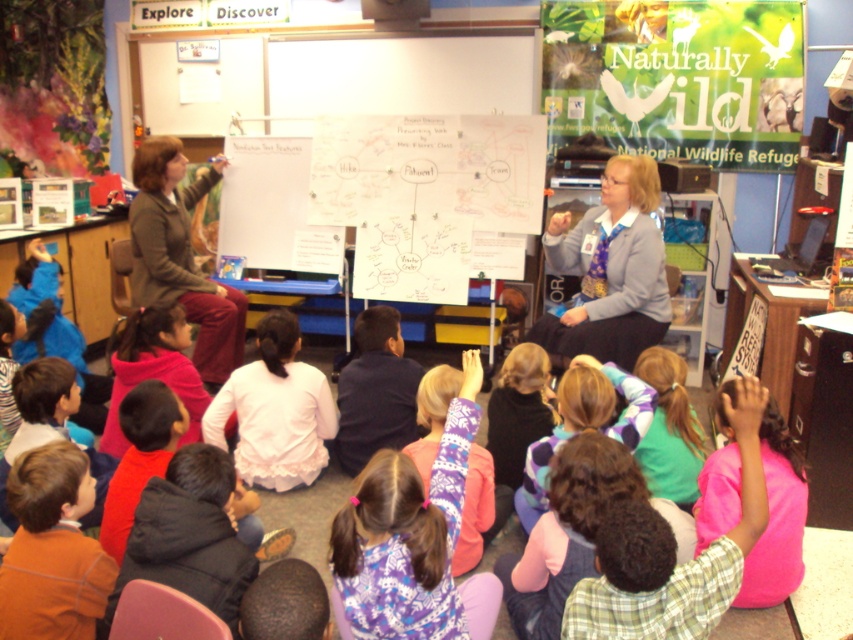
You are a student sitting in the classroom and want to hand a paper to both the person wearing the matte gray sweater at center and the matte green jacket at upper left. Which one should you approach first to ensure you can reach them without moving around others?

You should approach the matte gray sweater at center first because it is closer to you than the matte green jacket at upper left, so you can reach them more easily without needing to move around others.

Where is the matte gray sweater at center located in the classroom?

The matte gray sweater at center is located at point (610, 269) in the classroom.